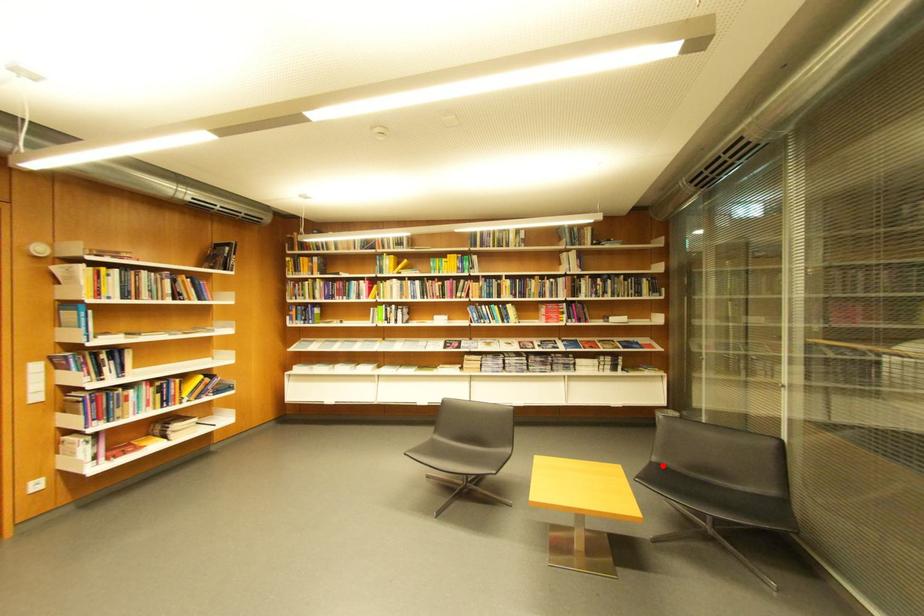
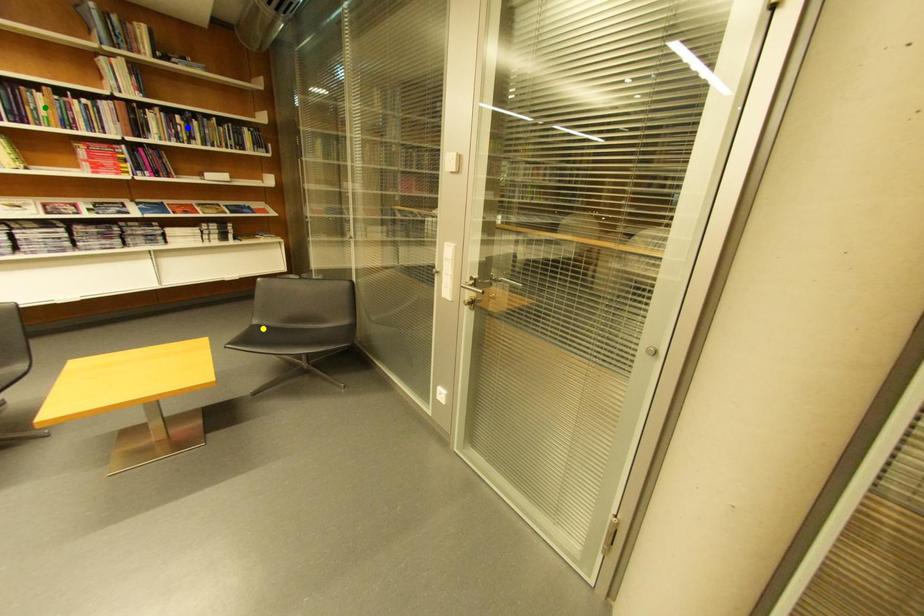
Question: I am providing you with two images of the same scene from different viewpoints. A red point is marked on the first image. You are given multiple points on the second image. Which point in image 2 is actually the same real-world point as the red point in image 1?

Choices:
 (A) blue point
 (B) yellow point
 (C) green point

Answer: (B)